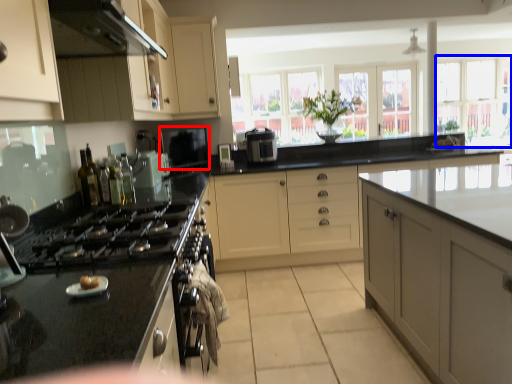
Question: Which point is closer to the camera, oven (highlighted by a red box) or window (highlighted by a blue box)?

Choices:
 (A) oven
 (B) window

Answer: (A)